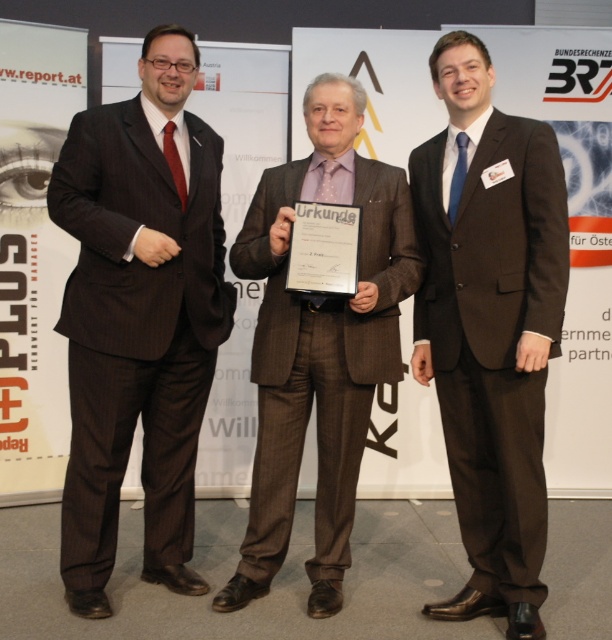
Question: Is matte brown suit at center thinner than brown textured suit at center?

Choices:
 (A) no
 (B) yes

Answer: (B)

Question: Which point is farther to the camera?

Choices:
 (A) (288, 380)
 (B) (118, 259)
 (C) (465, 214)

Answer: (A)

Question: Observing the image, what is the correct spatial positioning of matte black suit at left in reference to matte brown suit at center?

Choices:
 (A) below
 (B) above

Answer: (B)

Question: Among these objects, which one is nearest to the camera?

Choices:
 (A) matte brown suit at center
 (B) brown textured suit at center

Answer: (A)

Question: Among these objects, which one is nearest to the camera?

Choices:
 (A) matte black suit at left
 (B) brown textured suit at center
 (C) matte brown suit at center

Answer: (C)

Question: Does matte black suit at left have a larger size compared to brown textured suit at center?

Choices:
 (A) yes
 (B) no

Answer: (A)